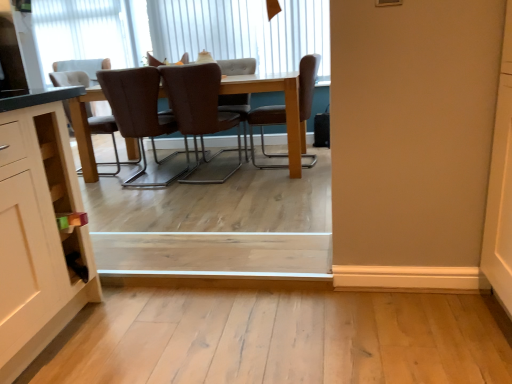
Question: Is brown leather chair at center, the 1th chair viewed from the right, facing away from brown leather chair at center, which ranks as the 3th chair in right-to-left order?

Choices:
 (A) no
 (B) yes

Answer: (A)

Question: Would you consider brown leather chair at center, placed as the 7th chair when sorted from left to right, to be distant from brown leather chair at center, which ranks as the 3th chair in right-to-left order?

Choices:
 (A) yes
 (B) no

Answer: (B)

Question: Can you confirm if brown leather chair at center, placed as the 7th chair when sorted from left to right, is positioned to the right of brown leather chair at center, which ranks as the 3th chair in right-to-left order?

Choices:
 (A) yes
 (B) no

Answer: (A)

Question: Is brown leather chair at center, the 1th chair viewed from the right, at the left side of brown leather chair at center, which ranks as the 3th chair in right-to-left order?

Choices:
 (A) yes
 (B) no

Answer: (B)

Question: Is the position of brown leather chair at center, the 1th chair viewed from the right, more distant than that of brown leather chair at center, which ranks as the 3th chair in right-to-left order?

Choices:
 (A) no
 (B) yes

Answer: (B)

Question: Is brown leather chair at center, the 1th chair viewed from the right, with brown leather chair at center, which ranks as the 3th chair in right-to-left order?

Choices:
 (A) no
 (B) yes

Answer: (A)

Question: Can you confirm if light wood plank at center is bigger than brown leather chair at center, the second chair from the right?

Choices:
 (A) no
 (B) yes

Answer: (A)

Question: From the image's perspective, is light wood plank at center beneath brown leather chair at center, placed as the 6th chair when sorted from left to right?

Choices:
 (A) no
 (B) yes

Answer: (B)

Question: Can you confirm if light wood plank at center is positioned to the right of brown leather chair at center, placed as the 6th chair when sorted from left to right?

Choices:
 (A) no
 (B) yes

Answer: (A)

Question: Is light wood plank at center positioned before brown leather chair at center, the second chair from the right?

Choices:
 (A) no
 (B) yes

Answer: (B)

Question: From the image's perspective, does light wood plank at center appear higher than brown leather chair at center, placed as the 6th chair when sorted from left to right?

Choices:
 (A) yes
 (B) no

Answer: (B)

Question: Is light wood plank at center behind brown leather chair at center, placed as the 6th chair when sorted from left to right?

Choices:
 (A) yes
 (B) no

Answer: (B)

Question: Can you confirm if white textured window at upper left, placed as the second window when sorted from right to left, is bigger than brown leather chair at center, which appears as the 3th chair when viewed from the left?

Choices:
 (A) no
 (B) yes

Answer: (A)